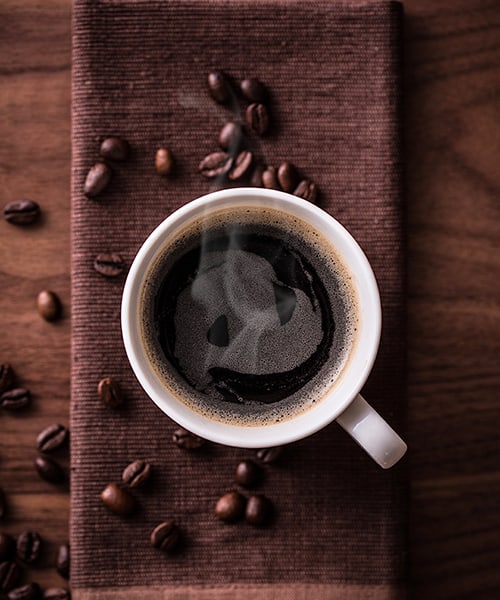
You are a GUI agent. You are given a task and a screenshot of the screen. Output one action in this format:
    pyautogui.click(x=<x>, y=<y>)
    Task: Click on the stitching on kitchen towel
    The width and height of the screenshot is (500, 600).
    Given the screenshot: What is the action you would take?
    pyautogui.click(x=322, y=588)